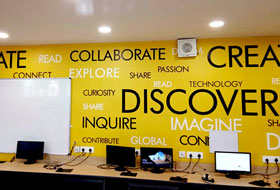
Identify the location of three recessed lights. (218, 24), (108, 31), (6, 36).